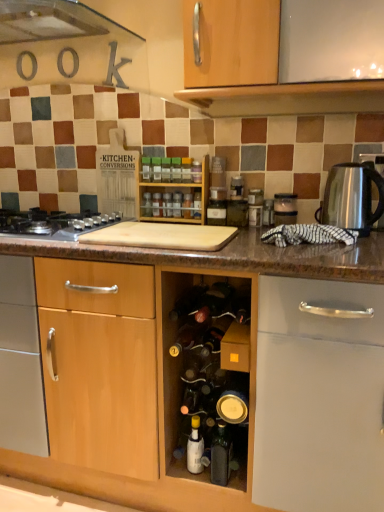
The height and width of the screenshot is (512, 384). What do you see at coordinates (187, 206) in the screenshot? I see `translucent glass spice at center, acting as the 5th bottle starting from the bottom` at bounding box center [187, 206].

At what (x,y) coordinates should I click in order to perform the action: click on green plastic spice at center, the 2th bottle from the top. Please return your answer as a coordinate pair (x, y). The width and height of the screenshot is (384, 512). Looking at the image, I should click on (156, 169).

Identify the location of translucent glass spice at center, the ninth bottle ordered from the bottom. (166, 170).

Find the location of a particular element. This screenshot has width=384, height=512. translucent glass spice at center, the 7th bottle viewed from the top is located at coordinates (187, 206).

Between point (286, 212) and point (171, 313), which one is positioned behind?

The point (286, 212) is more distant.

Who is shorter, satin silver toaster at upper right or dark glass wine bottle at center?

dark glass wine bottle at center is shorter.

Are satin silver toaster at upper right and dark glass wine bottle at center located far from each other?

No, satin silver toaster at upper right is not far from dark glass wine bottle at center.

From the image's perspective, is translucent glass spice at center, the 7th bottle viewed from the top, positioned above or below translucent glass spice at center, which is counted as the 8th bottle, starting from the top?

Based on their image positions, translucent glass spice at center, the 7th bottle viewed from the top, is located above translucent glass spice at center, which is counted as the 8th bottle, starting from the top.

Is translucent glass spice at center, the 7th bottle viewed from the top, not close to translucent glass spice at center, the fourth bottle positioned from the bottom?

translucent glass spice at center, the 7th bottle viewed from the top, is near translucent glass spice at center, the fourth bottle positioned from the bottom, not far away.

Does point (186, 198) lie behind point (165, 212)?

No, (186, 198) is in front of (165, 212).

Does translucent glass spice at center, the 7th bottle viewed from the top, come behind translucent glass spice at center, which is counted as the 8th bottle, starting from the top?

No.

Which is in front, translucent glass spice at center, the fourth bottle positioned from the bottom, or dark glass wine bottle at center?

dark glass wine bottle at center is closer to the camera.

From the image's perspective, is translucent glass spice at center, which is counted as the 8th bottle, starting from the top, above or below dark glass wine bottle at center?

translucent glass spice at center, which is counted as the 8th bottle, starting from the top, is situated higher than dark glass wine bottle at center in the image.

The height and width of the screenshot is (512, 384). I want to click on wine bottle on the right of translucent glass spice at center, which is counted as the 8th bottle, starting from the top, so click(x=187, y=302).

Between translucent glass spice at center, the fifth bottle viewed from the top, and silver metallic gas stove at left, which one has more height?

translucent glass spice at center, the fifth bottle viewed from the top, is taller.

How much distance is there between translucent glass spice at center, the fifth bottle viewed from the top, and silver metallic gas stove at left?

A distance of 35.82 centimeters exists between translucent glass spice at center, the fifth bottle viewed from the top, and silver metallic gas stove at left.

From the image's perspective, does translucent glass spice at center, the fifth bottle viewed from the top, appear higher than silver metallic gas stove at left?

Correct, translucent glass spice at center, the fifth bottle viewed from the top, appears higher than silver metallic gas stove at left in the image.

From the image's perspective, is white glossy bottle at center, the second bottle ordered from the bottom, located above or below translucent plastic spice jar at center, which is the 8th bottle from bottom to top?

Clearly, from the image's perspective, white glossy bottle at center, the second bottle ordered from the bottom, is below translucent plastic spice jar at center, which is the 8th bottle from bottom to top.

Considering the positions of points (198, 460) and (200, 178), is point (198, 460) closer to camera compared to point (200, 178)?

Yes, point (198, 460) is closer to viewer.

Can you confirm if white glossy bottle at center, marked as the tenth bottle in a top-to-bottom arrangement, is thinner than translucent plastic spice jar at center, the fourth bottle positioned from the top?

In fact, white glossy bottle at center, marked as the tenth bottle in a top-to-bottom arrangement, might be wider than translucent plastic spice jar at center, the fourth bottle positioned from the top.

Do you think white glossy bottle at center, the second bottle ordered from the bottom, is within translucent plastic spice jar at center, which is the 8th bottle from bottom to top, or outside of it?

white glossy bottle at center, the second bottle ordered from the bottom, is not inside translucent plastic spice jar at center, which is the 8th bottle from bottom to top, it's outside.

Are matte black bottle at center, which is counted as the 11th bottle, starting from the top, and translucent glass spice at center, the 7th bottle viewed from the top, making contact?

They are not placed beside each other.

From the image's perspective, is matte black bottle at center, positioned as the first bottle in bottom-to-top order, on translucent glass spice at center, the 7th bottle viewed from the top?

Incorrect, from the image's perspective, matte black bottle at center, positioned as the first bottle in bottom-to-top order, is lower than translucent glass spice at center, the 7th bottle viewed from the top.

Would you say translucent glass spice at center, arranged as the 7th bottle when ordered from the bottom, is outside translucent glass spice at center, which is the 6th bottle from top to bottom?

Indeed, translucent glass spice at center, arranged as the 7th bottle when ordered from the bottom, is completely outside translucent glass spice at center, which is the 6th bottle from top to bottom.

From a real-world perspective, between translucent glass spice at center, arranged as the 7th bottle when ordered from the bottom, and translucent glass spice at center, placed as the sixth bottle when sorted from bottom to top, who is vertically lower?

translucent glass spice at center, placed as the sixth bottle when sorted from bottom to top, from a real-world perspective.

From a real-world perspective, starting from the translucent glass spice at center, arranged as the 7th bottle when ordered from the bottom, which bottle is the 1st one below it? Please provide its 2D coordinates.

[(157, 204)]

Locate an element on the screen. appliance above the dark glass wine bottle at center (from a real-world perspective) is located at coordinates (285, 208).

Where is `the 2nd bottle to the left when counting from the translucent glass spice at center, the 7th bottle viewed from the top`? the 2nd bottle to the left when counting from the translucent glass spice at center, the 7th bottle viewed from the top is located at coordinates pos(167,205).

Which object lies further to the anchor point translucent glass spice at center, acting as the 5th bottle starting from the bottom, green plastic spice at center, arranged as the 10th bottle when ordered from the bottom, or satin silver toaster at upper right?

satin silver toaster at upper right.

Estimate the real-world distances between objects in this image. Which object is further from translucent glass spice at center, which is the 6th bottle from top to bottom, translucent plastic spice at center, the 11th bottle from the bottom, or translucent plastic spice jar at center, which is the 8th bottle from bottom to top?

Among the two, translucent plastic spice jar at center, which is the 8th bottle from bottom to top, is located further to translucent glass spice at center, which is the 6th bottle from top to bottom.

Estimate the real-world distances between objects in this image. Which object is further from translucent glass spice at center, which ranks as the ninth bottle in top-to-bottom order, translucent glass spice at center, which is the 6th bottle from top to bottom, or wooden spice rack at center?

Based on the image, translucent glass spice at center, which is the 6th bottle from top to bottom, appears to be further to translucent glass spice at center, which ranks as the ninth bottle in top-to-bottom order.

When comparing their distances from white glossy bottle at center, marked as the tenth bottle in a top-to-bottom arrangement, does translucent glass spice at center, the ninth bottle ordered from the bottom, or translucent glass spice at center, placed as the sixth bottle when sorted from bottom to top, seem further?

Among the two, translucent glass spice at center, the ninth bottle ordered from the bottom, is located further to white glossy bottle at center, marked as the tenth bottle in a top-to-bottom arrangement.

Looking at this image, based on their spatial positions, is satin silver kettle at right or dark glass wine bottle at center further from translucent glass spice at center, which is counted as the 8th bottle, starting from the top?

The object further to translucent glass spice at center, which is counted as the 8th bottle, starting from the top, is satin silver kettle at right.

Estimate the real-world distances between objects in this image. Which object is further from translucent glass spice at center, acting as the 5th bottle starting from the bottom, satin silver kettle at right or silver metallic gas stove at left?

Based on the image, satin silver kettle at right appears to be further to translucent glass spice at center, acting as the 5th bottle starting from the bottom.

Considering their positions, is white glossy bottle at center, marked as the tenth bottle in a top-to-bottom arrangement, positioned closer to silver metallic gas stove at left than dark glass wine bottle at center?

The object closer to silver metallic gas stove at left is dark glass wine bottle at center.

When comparing their distances from satin silver kettle at right, does translucent glass spice at center, the ninth bottle ordered from the bottom, or translucent glass spice at center, placed as the sixth bottle when sorted from bottom to top, seem closer?

translucent glass spice at center, the ninth bottle ordered from the bottom, lies closer to satin silver kettle at right than the other object.

Locate an element on the screen. This screenshot has height=512, width=384. cabinetry between green plastic spice at center, arranged as the 10th bottle when ordered from the bottom, and translucent glass spice at center, acting as the 5th bottle starting from the bottom, vertically is located at coordinates (178, 191).

Where is `cabinetry between translucent plastic spice at center, the 11th bottle from the bottom, and matte black bottle at center, which is counted as the 11th bottle, starting from the top, in the vertical direction`? cabinetry between translucent plastic spice at center, the 11th bottle from the bottom, and matte black bottle at center, which is counted as the 11th bottle, starting from the top, in the vertical direction is located at coordinates (178, 191).

Identify the location of wine bottle between translucent glass spice at center, which is counted as the 8th bottle, starting from the top, and satin silver kettle at right, in the horizontal direction. The image size is (384, 512). [187, 302].

You are a GUI agent. You are given a task and a screenshot of the screen. Output one action in this format:
    pyautogui.click(x=<x>, y=<y>)
    Task: Click on the appliance between translucent glass spice at center, the ninth bottle ordered from the bottom, and dark glass wine bottle at center vertically
    This screenshot has height=512, width=384.
    Given the screenshot: What is the action you would take?
    pyautogui.click(x=285, y=208)